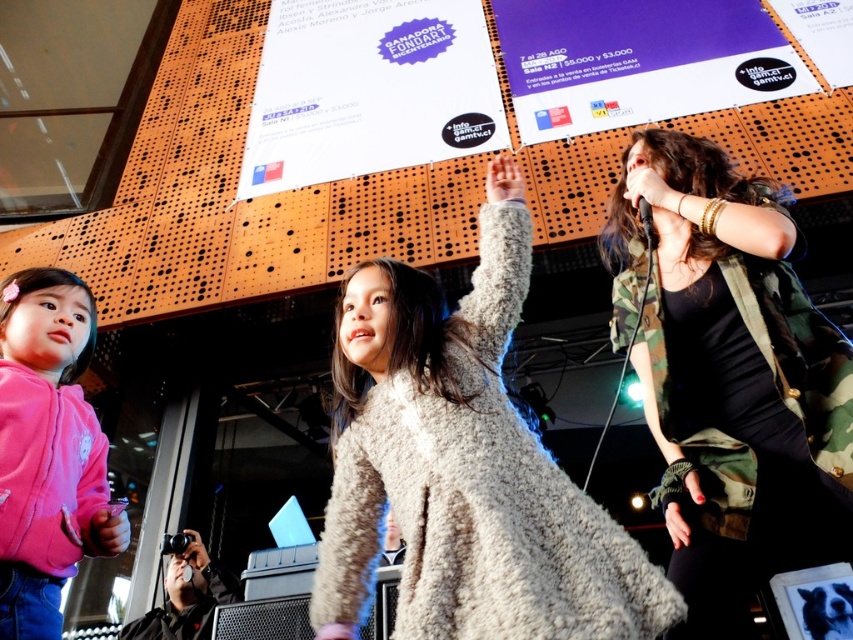
Question: Can you confirm if white paper poster at upper center is positioned above orange paper poster at upper right?

Choices:
 (A) yes
 (B) no

Answer: (B)

Question: Which point is farther from the camera taking this photo?

Choices:
 (A) (198, 563)
 (B) (73, 436)

Answer: (A)

Question: Which object is closer to the camera taking this photo?

Choices:
 (A) orange paper poster at upper right
 (B) camouflage fabric hand at upper right
 (C) pink fleece jacket at lower left

Answer: (C)

Question: Can you confirm if fluffy beige coat at center is positioned to the left of camouflage fabric hand at upper right?

Choices:
 (A) yes
 (B) no

Answer: (A)

Question: Does fluffy beige coat at center have a larger size compared to camouflage fabric hand at upper right?

Choices:
 (A) no
 (B) yes

Answer: (B)

Question: Which of the following is the closest to the observer?

Choices:
 (A) (80, 344)
 (B) (689, 140)

Answer: (A)